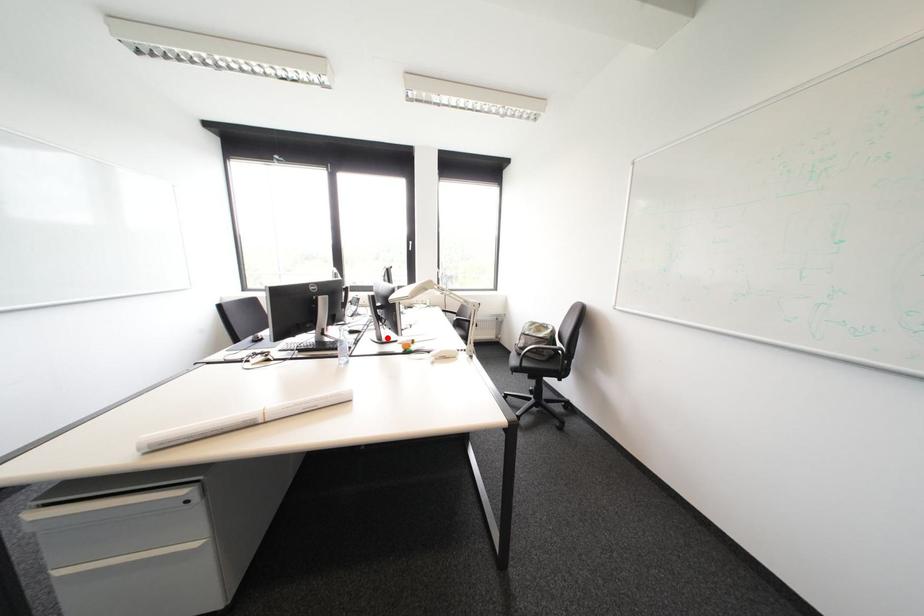
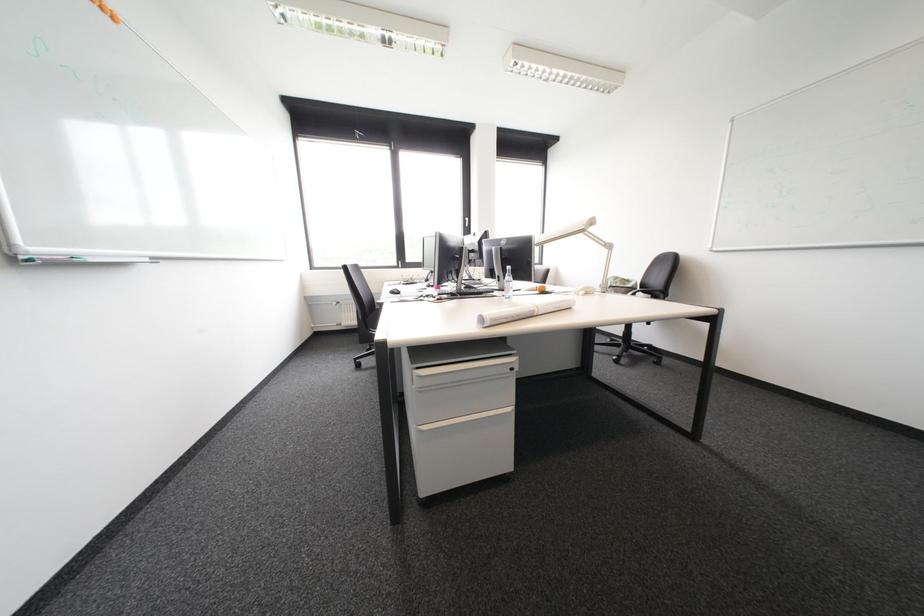
Find the pixel in the second image that matches the highlighted location in the first image.

(509, 289)